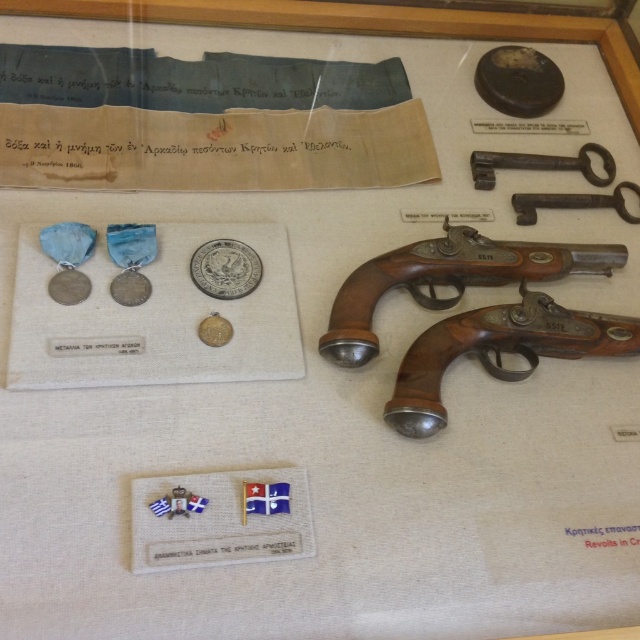
In the scene shown: You are a museum visitor looking at the display case. You want to take a photo of both the dark brown wood key at upper right and the gold plated coin at center. Which object should you focus on first to ensure both are in clear view?

You should focus on the dark brown wood key at upper right first because it is closer to you than the gold plated coin at center, so adjusting focus starting from the closer object will help both be in clear view.

You are a museum security guard standing at the entrance of the display case. You need to inspect both the brown wooden pistol at center and the camera. Which object should you check first if you want to minimize the distance you walk?

You should check the brown wooden pistol at center first because it is closer to your starting position at the entrance than the camera, which is 3.69 feet away from the pistol.

What are the coordinates of the brown wooden pistol at center?

The brown wooden pistol at center is located at coordinates point (449, 280).